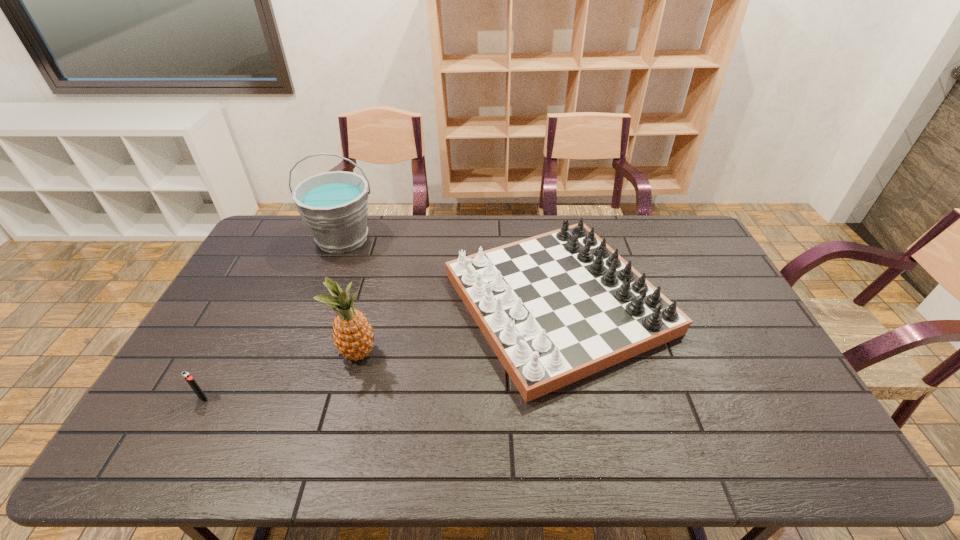
You are a GUI agent. You are given a task and a screenshot of the screen. Output one action in this format:
    pyautogui.click(x=<x>, y=<y>)
    Task: Click on the bucket that is at the far edge
    The width and height of the screenshot is (960, 540).
    Given the screenshot: What is the action you would take?
    pyautogui.click(x=334, y=205)

Image resolution: width=960 pixels, height=540 pixels. Find the location of `gameboard that is at the far edge`. gameboard that is at the far edge is located at coordinates (557, 307).

The image size is (960, 540). I want to click on object that is at the left edge, so pos(190,380).

Find the location of a particular element. free space at the far edge of the desktop is located at coordinates 636,241.

Locate an element on the screen. vacant space at the near edge is located at coordinates (372, 458).

The image size is (960, 540). I want to click on vacant space at the left edge, so (293, 258).

The width and height of the screenshot is (960, 540). In the image, there is a desktop. Find the location of `vacant space at the far right corner`. vacant space at the far right corner is located at coordinates (659, 229).

In order to click on empty space that is in between the igniter and the third shortest object in this screenshot , I will do `click(281, 376)`.

Image resolution: width=960 pixels, height=540 pixels. Identify the location of free space between the pineapple and the rightmost object. (458, 328).

Locate an element on the screen. This screenshot has height=540, width=960. free space between the pineapple and the leftmost object is located at coordinates (281, 376).